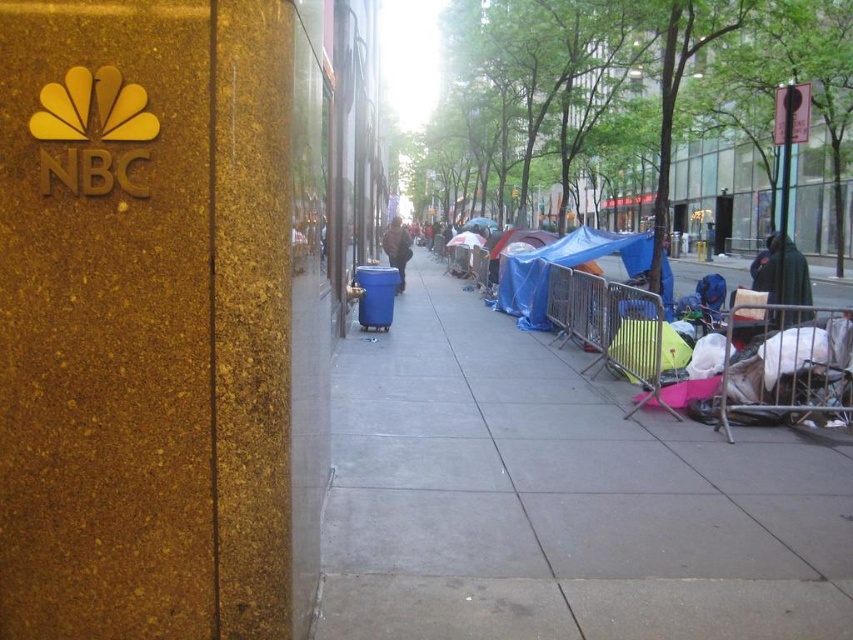
You are a delivery person trying to navigate through the sidewalk. You see a white fabric baby carriage at lower right and a dark green cloak at right. Which object is narrower?

The white fabric baby carriage at lower right is narrower than the dark green cloak at right.